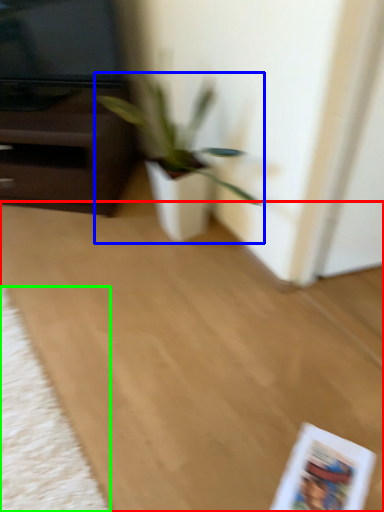
Question: Which object is positioned closest to plain (highlighted by a red box)? Select from houseplant (highlighted by a blue box) and mat (highlighted by a green box).

Choices:
 (A) houseplant
 (B) mat

Answer: (B)